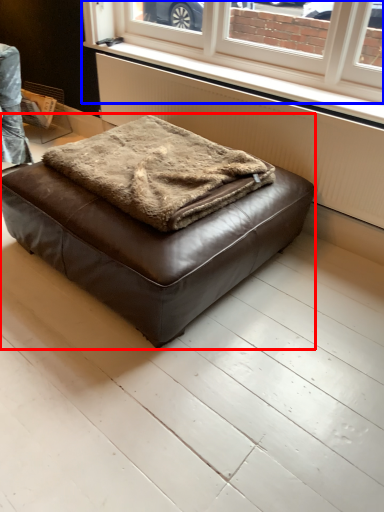
Question: Among these objects, which one is farthest to the camera, furniture (highlighted by a red box) or window (highlighted by a blue box)?

Choices:
 (A) furniture
 (B) window

Answer: (B)